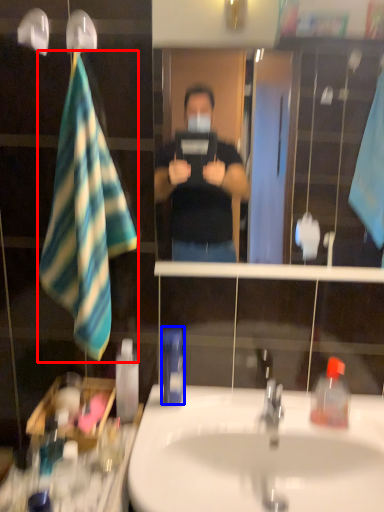
Question: Among these objects, which one is nearest to the camera, beach towel (highlighted by a red box) or mouthwash (highlighted by a blue box)?

Choices:
 (A) beach towel
 (B) mouthwash

Answer: (A)